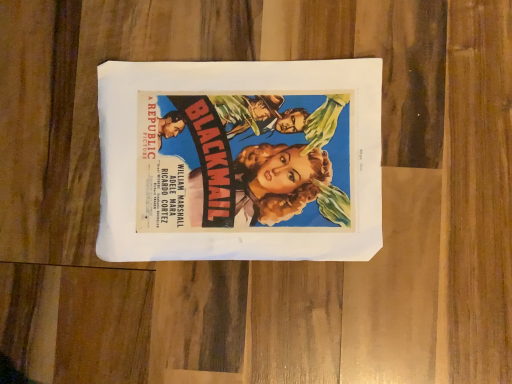
I want to click on matte paper poster at center, so click(x=240, y=160).

In order to face matte paper poster at center, should I rotate leftwards or rightwards?

Turn left approximately 2.360 degrees to face it.

Image resolution: width=512 pixels, height=384 pixels. Describe the element at coordinates (240, 160) in the screenshot. I see `matte paper poster at center` at that location.

This screenshot has width=512, height=384. In order to click on matte paper poster at center in this screenshot , I will do pyautogui.click(x=240, y=160).